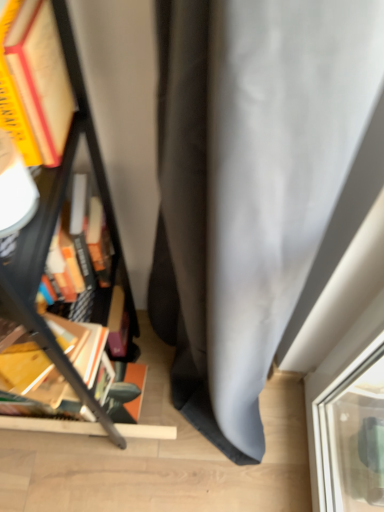
Question: Considering the relative positions of matte black bookcase at left and wooden book at left in the image provided, is matte black bookcase at left to the left or to the right of wooden book at left?

Choices:
 (A) right
 (B) left

Answer: (B)

Question: From their relative heights in the image, would you say matte black bookcase at left is taller or shorter than wooden book at left?

Choices:
 (A) tall
 (B) short

Answer: (A)

Question: Which is correct: matte black bookcase at left is inside wooden book at left, or outside of it?

Choices:
 (A) inside
 (B) outside

Answer: (B)

Question: In terms of width, does wooden book at left look wider or thinner when compared to matte black bookcase at left?

Choices:
 (A) thin
 (B) wide

Answer: (A)

Question: Is wooden book at left bigger or smaller than matte black bookcase at left?

Choices:
 (A) small
 (B) big

Answer: (A)

Question: From a real-world perspective, is wooden book at left physically located above or below matte black bookcase at left?

Choices:
 (A) above
 (B) below

Answer: (A)

Question: In terms of height, does wooden book at left look taller or shorter compared to matte black bookcase at left?

Choices:
 (A) short
 (B) tall

Answer: (A)